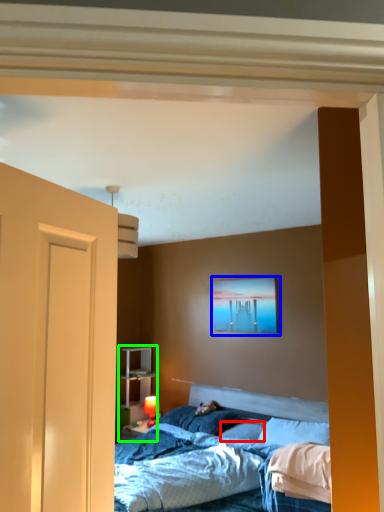
Question: Considering the real-world distances, which object is farthest from pillow (highlighted by a red box)? picture frame (highlighted by a blue box) or dresser (highlighted by a green box)?

Choices:
 (A) picture frame
 (B) dresser

Answer: (B)